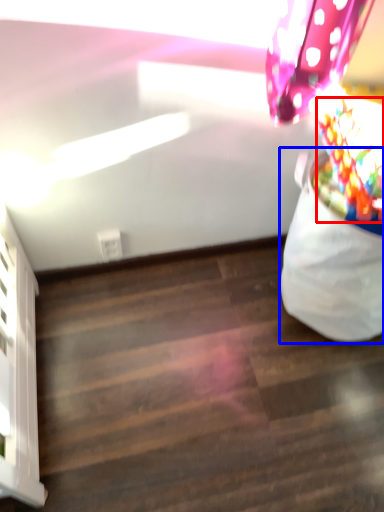
Question: Which point is further to the camera, flower (highlighted by a red box) or bean bag chair (highlighted by a blue box)?

Choices:
 (A) flower
 (B) bean bag chair

Answer: (B)